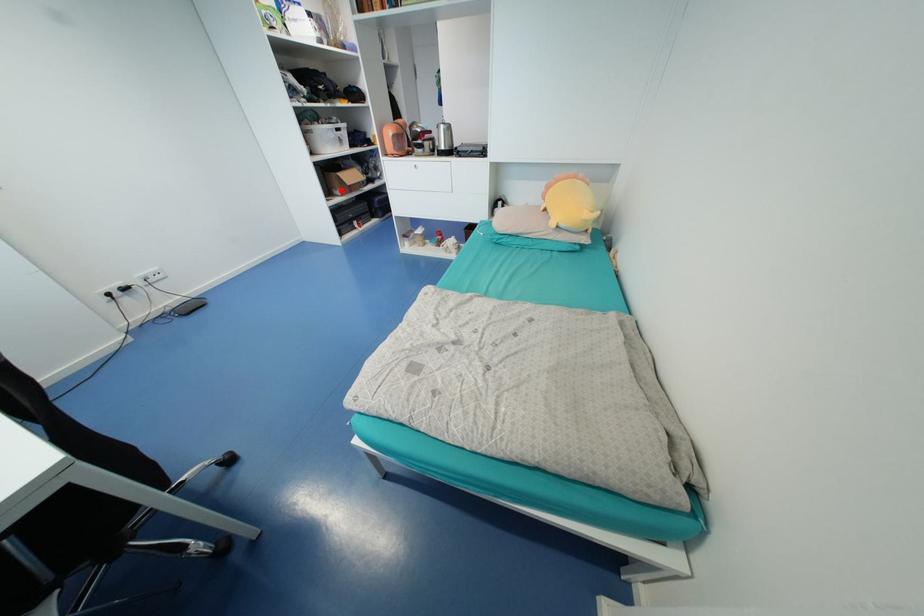
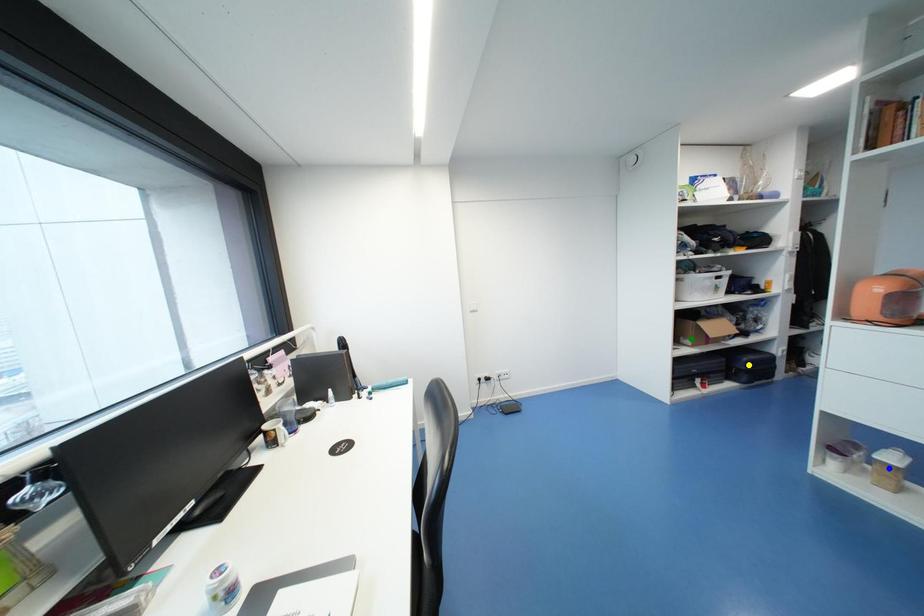
Question: I am providing you with two images of the same scene from different viewpoints. A red point is marked on the first image. You are given multiple points on the second image. Which spot in image 2 lines up with the point in image 1?

Choices:
 (A) green point
 (B) yellow point
 (C) blue point

Answer: (A)